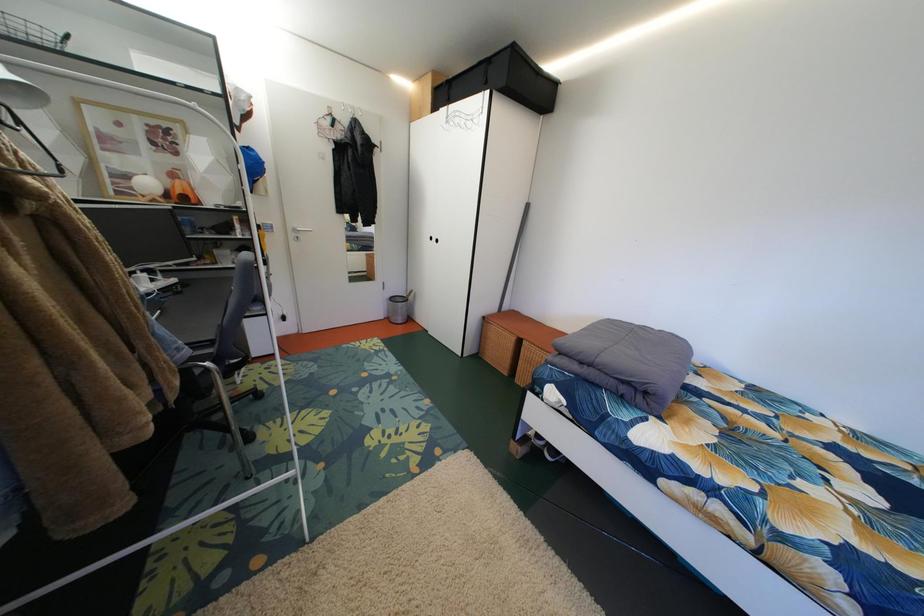
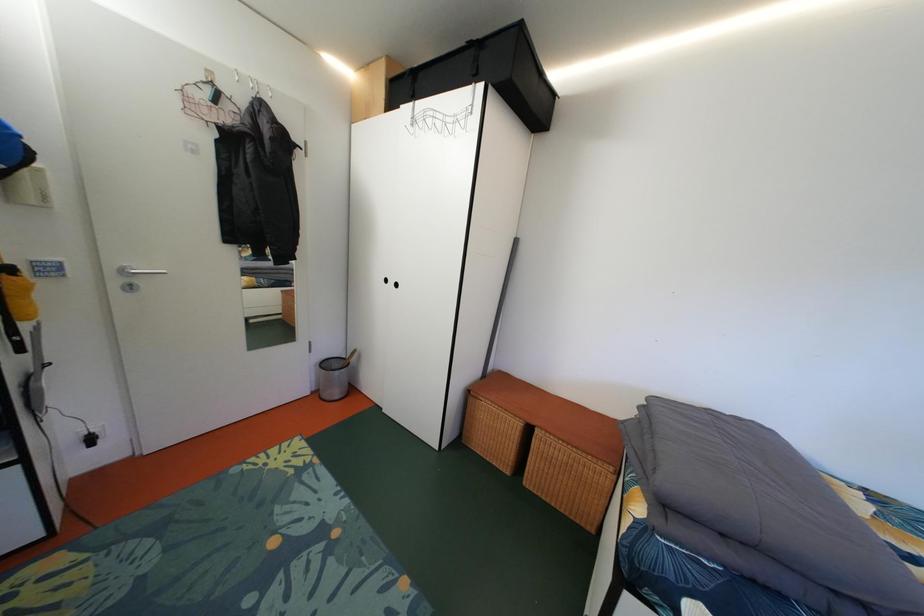
Question: The camera is either moving clockwise (left) or counter-clockwise (right) around the object. The first image is from the beginning of the video and the second image is from the end. Is the camera moving left or right when shooting the video?

Choices:
 (A) Left
 (B) Right

Answer: (A)